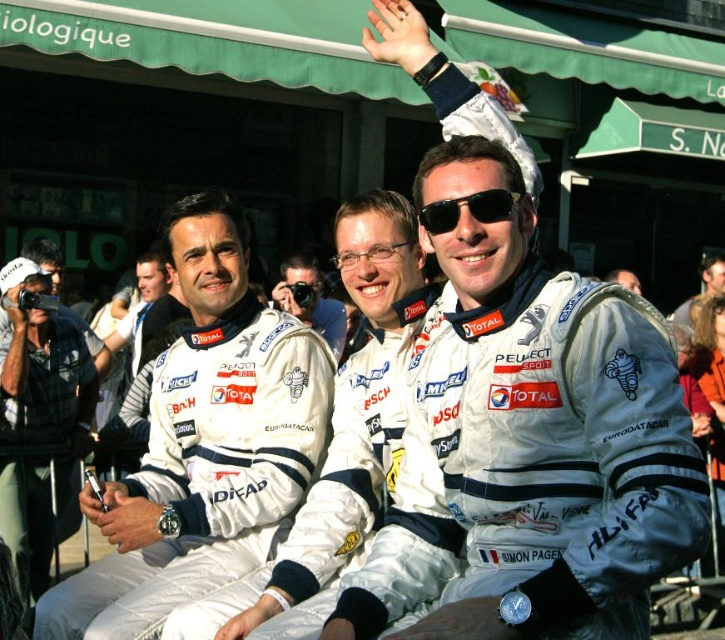
The image size is (725, 640). What do you see at coordinates (310, 300) in the screenshot?
I see `white/textured racing suit at center` at bounding box center [310, 300].

Which is more to the right, white/textured racing suit at center or white racing suit at center?

Positioned to the right is white racing suit at center.

Find the location of a particular element. This screenshot has width=725, height=640. white/textured racing suit at center is located at coordinates (310, 300).

I want to click on white/textured racing suit at center, so click(x=310, y=300).

Which is above, white racing suit at center or transparent plastic goggles at center?

white racing suit at center is above.

Based on the photo, which of these two, white racing suit at center or transparent plastic goggles at center, stands shorter?

transparent plastic goggles at center is shorter.

Which is in front, point (674, 317) or point (355, 252)?

Positioned in front is point (355, 252).

The height and width of the screenshot is (640, 725). I want to click on white racing suit at center, so click(x=703, y=285).

Which of these two, white smooth racing suit at left or green plaid shirt at left, stands shorter?

white smooth racing suit at left is shorter.

Does point (145, 625) come in front of point (33, 360)?

Yes.

At what (x,y) coordinates should I click in order to perform the action: click on white smooth racing suit at left. Please return your answer as a coordinate pair (x, y). The image size is (725, 640). Looking at the image, I should click on (203, 444).